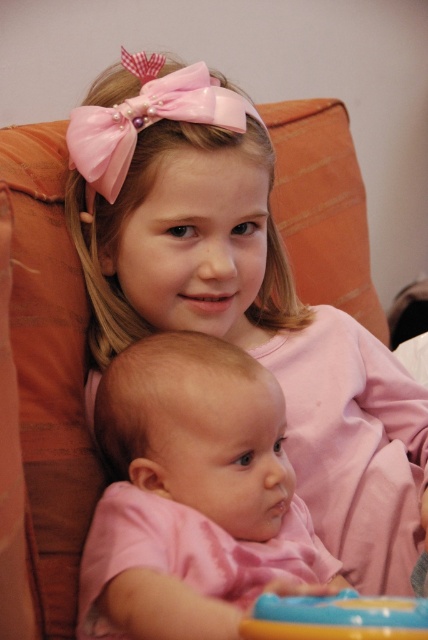
Who is taller, pink satin baby at center or smooth plastic toy at lower center?

Standing taller between the two is pink satin baby at center.

Who is lower down, pink satin baby at center or smooth plastic toy at lower center?

smooth plastic toy at lower center is lower down.

Find the location of a particular element. The height and width of the screenshot is (640, 428). pink satin baby at center is located at coordinates (193, 497).

Identify the location of pink satin baby at center. pyautogui.click(x=193, y=497).

Is point (116, 536) more distant than point (106, 164)?

No, (116, 536) is in front of (106, 164).

You are a GUI agent. You are given a task and a screenshot of the screen. Output one action in this format:
    pyautogui.click(x=<x>, y=<y>)
    Task: Click on the pink satin baby at center
    
    Given the screenshot: What is the action you would take?
    pyautogui.click(x=193, y=497)

From the picture: Can you confirm if pink glossy bow at upper center is positioned to the right of smooth plastic toy at lower center?

In fact, pink glossy bow at upper center is to the left of smooth plastic toy at lower center.

Who is more forward, (181, 100) or (243, 634)?

Point (243, 634) is more forward.

Identify the location of pink glossy bow at upper center. (146, 120).